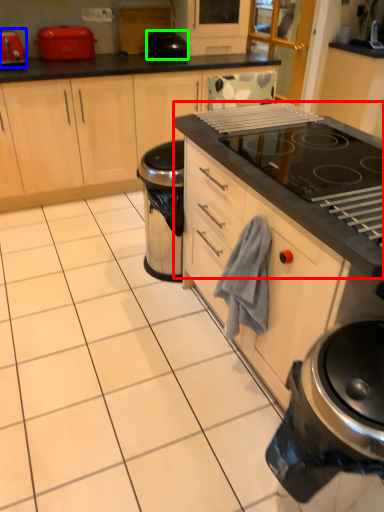
Question: Which is nearer to the oven (highlighted by a red box)? kitchen appliance (highlighted by a blue box) or appliance (highlighted by a green box).

Choices:
 (A) kitchen appliance
 (B) appliance

Answer: (B)